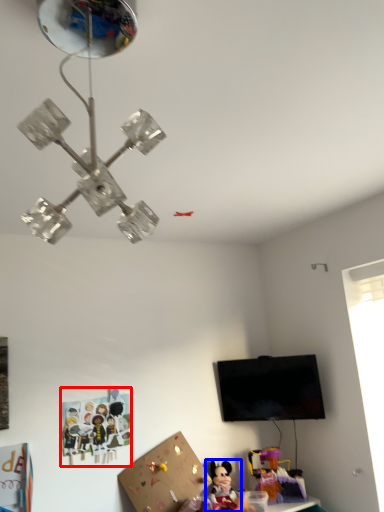
Question: Which of the following is the farthest to the observer, toy (highlighted by a red box) or toy (highlighted by a blue box)?

Choices:
 (A) toy
 (B) toy

Answer: (A)